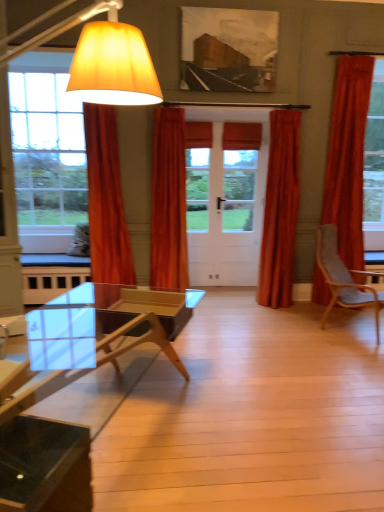
Identify the location of free location above matte canvas picture frame at upper center (from a real-world perspective). Image resolution: width=384 pixels, height=512 pixels. (225, 6).